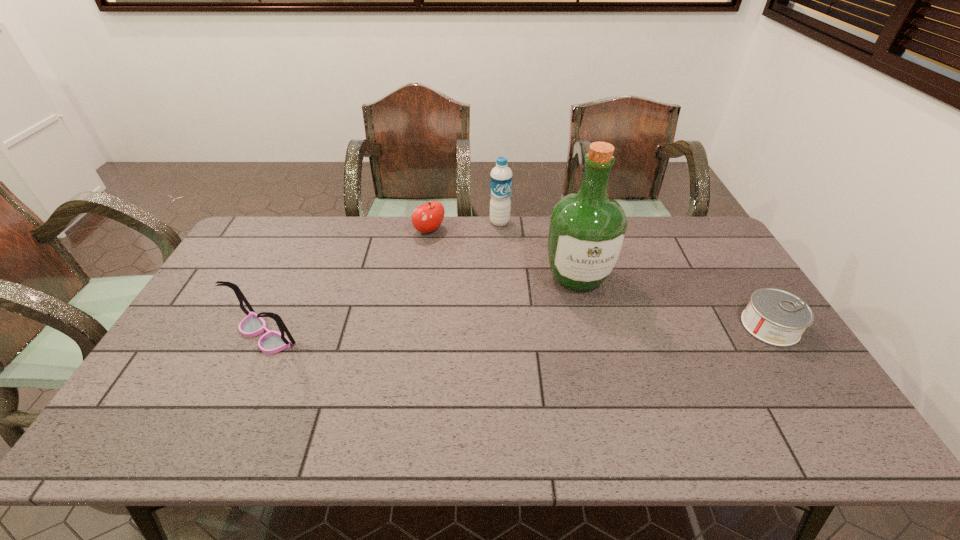
Identify the location of the third tallest object. This screenshot has height=540, width=960. (253, 324).

You are a GUI agent. You are given a task and a screenshot of the screen. Output one action in this format:
    pyautogui.click(x=<x>, y=<y>)
    Task: Click on the spectacles
    This screenshot has height=540, width=960.
    Given the screenshot: What is the action you would take?
    pyautogui.click(x=253, y=324)

At what (x,y) coordinates should I click in order to perform the action: click on can. Please return your answer as a coordinate pair (x, y). The width and height of the screenshot is (960, 540). Looking at the image, I should click on (776, 317).

Find the location of a particular element. The image size is (960, 540). the shortest object is located at coordinates (776, 317).

Where is `the third object from right to left`? the third object from right to left is located at coordinates (501, 175).

You are a GUI agent. You are given a task and a screenshot of the screen. Output one action in this format:
    pyautogui.click(x=<x>, y=<y>)
    Task: Click on the water bottle
    This screenshot has width=960, height=540.
    Given the screenshot: What is the action you would take?
    pyautogui.click(x=501, y=175)

Where is `apple`? apple is located at coordinates (426, 218).

The width and height of the screenshot is (960, 540). I want to click on the second shortest object, so click(x=426, y=218).

Identify the location of the tallest object. (587, 230).

The image size is (960, 540). I want to click on the fourth object from left to right, so click(x=587, y=230).